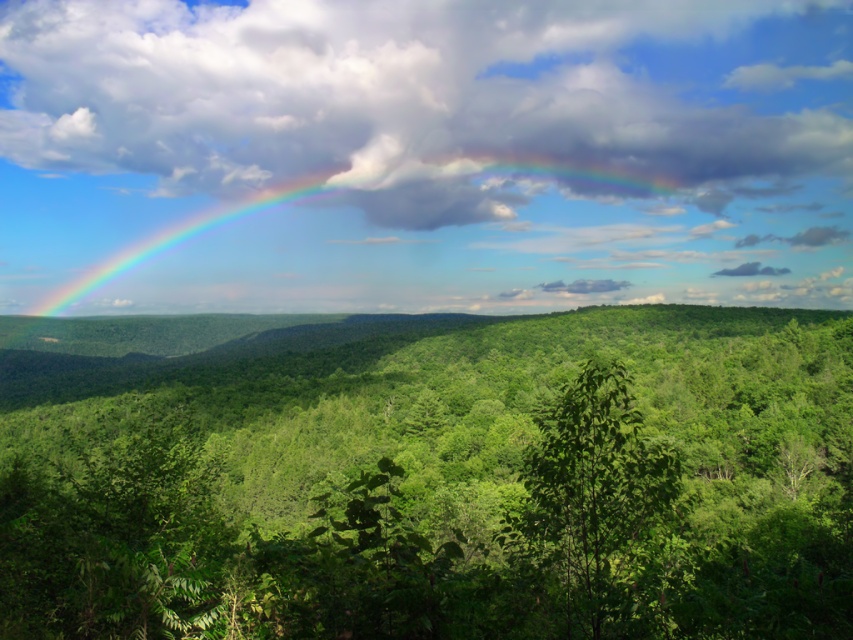
In the scene shown: You are an environmental scientist observing the landscape. You notice the green leafy forest at center and the green leafy tree at center. Which one has a larger area coverage in the image?

The green leafy forest at center has a larger area coverage than the green leafy tree at center because it is bigger in size according to the description.

You are standing in a natural landscape with a cloudy sky at upper center and a green leafy tree at lower left. Which object is closer to you?

The green leafy tree at lower left is closer to you because the cloudy sky at upper center is further away.